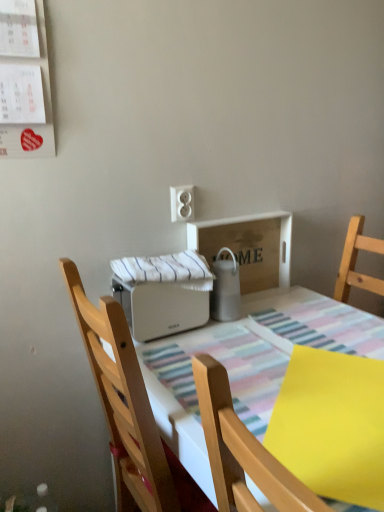
The width and height of the screenshot is (384, 512). In order to click on free area below wooden tray at center (from a real-world perspective) in this screenshot , I will do `click(256, 295)`.